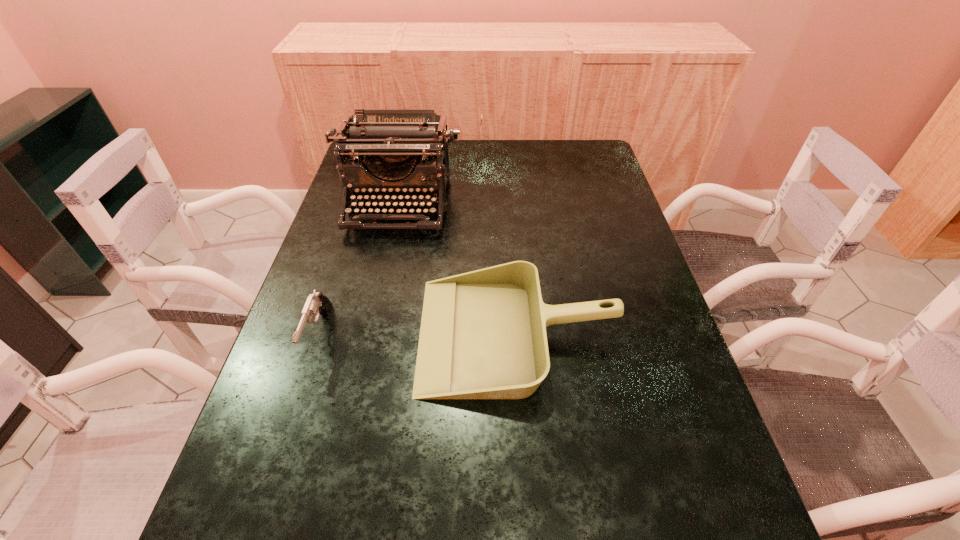
Where is `the farthest object`? the farthest object is located at coordinates (401, 137).

Locate an element on the screen. typewriter is located at coordinates click(401, 137).

Where is `gun`? The height and width of the screenshot is (540, 960). gun is located at coordinates (316, 303).

This screenshot has height=540, width=960. Find the location of `dustpan`. dustpan is located at coordinates (483, 335).

Identify the location of vacant space located on the typing side of the farthest object. Image resolution: width=960 pixels, height=540 pixels. (371, 327).

Find the location of `free region located 0.220m at the muzzle of the gun`. free region located 0.220m at the muzzle of the gun is located at coordinates click(x=273, y=477).

Locate an element on the screen. The image size is (960, 540). free spot located 0.300m on the scoop of the dustpan is located at coordinates (285, 334).

The height and width of the screenshot is (540, 960). I want to click on vacant space positioned on the scoop of the dustpan, so click(x=303, y=334).

The width and height of the screenshot is (960, 540). Find the location of `vacant area located 0.070m on the scoop of the dustpan`. vacant area located 0.070m on the scoop of the dustpan is located at coordinates (389, 334).

I want to click on object located in the far edge section of the desktop, so click(x=401, y=137).